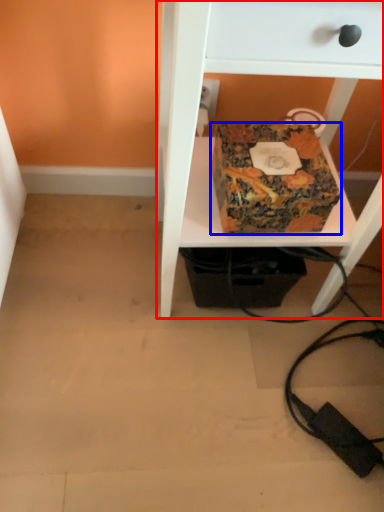
Question: Which point is closer to the camera, furniture (highlighted by a red box) or box (highlighted by a blue box)?

Choices:
 (A) furniture
 (B) box

Answer: (A)